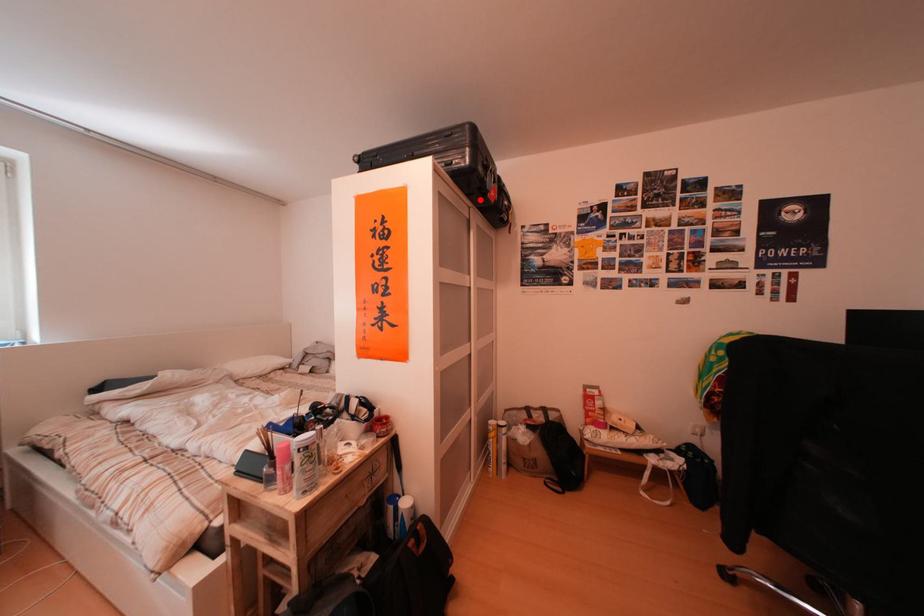
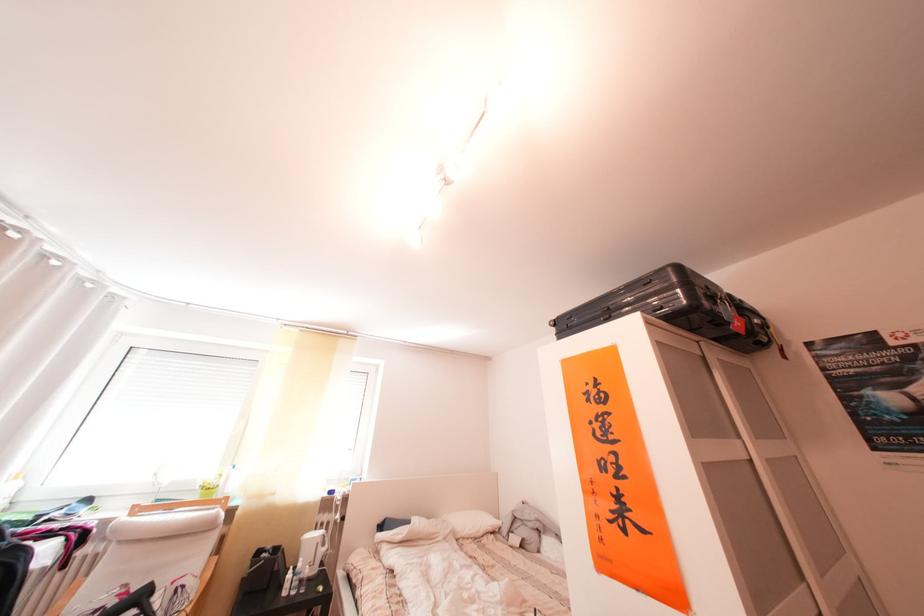
The point at the highlighted location is marked in the first image. Where is the corresponding point in the second image?

(703, 336)